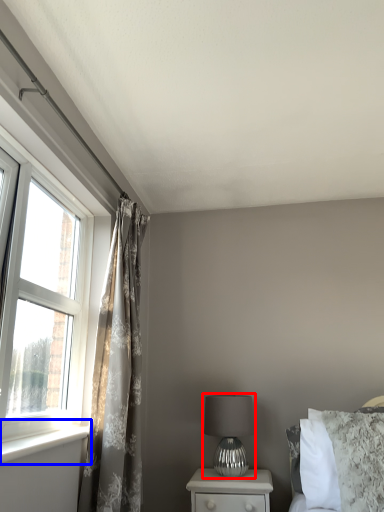
Question: Which point is closer to the camera, table lamp (highlighted by a red box) or window sill (highlighted by a blue box)?

Choices:
 (A) table lamp
 (B) window sill

Answer: (B)